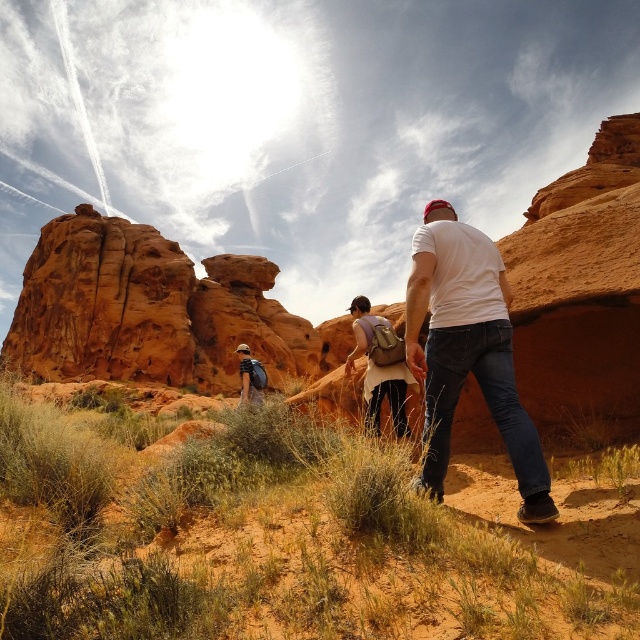
Describe the element at coordinates (292, 538) in the screenshot. I see `desert grass at center` at that location.

Can you confirm if desert grass at center is positioned below white matte shirt at center?

Indeed, desert grass at center is positioned under white matte shirt at center.

Between point (17, 504) and point (481, 269), which one is positioned in front?

Point (17, 504)

Image resolution: width=640 pixels, height=640 pixels. Identify the location of desert grass at center. (292, 538).

How far apart are rustic sandstone rock formation at left and white matte shirt at center?

rustic sandstone rock formation at left and white matte shirt at center are 348.40 feet apart.

Which is behind, point (237, 317) or point (440, 291)?

The point (237, 317) is behind.

Is point (74, 262) farther from viewer compared to point (496, 316)?

Yes.

This screenshot has height=640, width=640. I want to click on rustic sandstone rock formation at left, so click(147, 310).

Is desert grass at center below matte brown backpack at center?

Yes, desert grass at center is below matte brown backpack at center.

This screenshot has height=640, width=640. Find the location of `desert grass at center`. desert grass at center is located at coordinates (292, 538).

The width and height of the screenshot is (640, 640). Identify the location of desert grass at center. (292, 538).